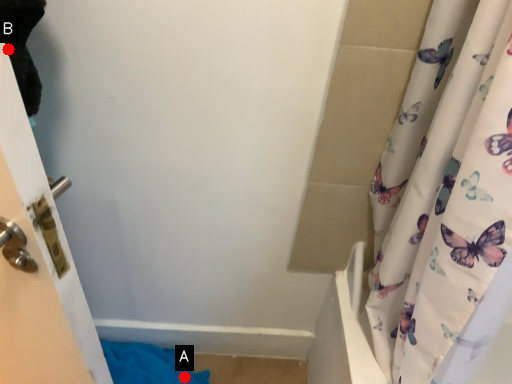
Question: Two points are circled on the image, labeled by A and B beside each circle. Which point is further to the camera?

Choices:
 (A) A is further
 (B) B is further

Answer: (A)